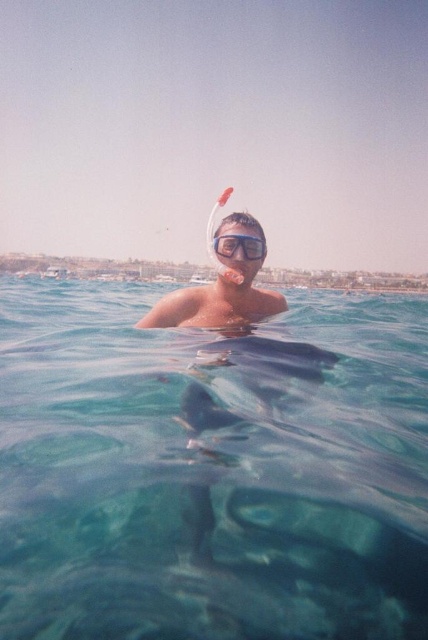
You are a lifeguard on duty and notice a swimmer in the water. You see the clear blue water at center and the matte plastic snorkel at upper center. Which object is closer to the right side of the image?

The clear blue water at center is to the right of the matte plastic snorkel at upper center, so the clear blue water at center is closer to the right side of the image.

You are a lifeguard observing the snorkeler in the scene. You need to check if the snorkel and goggles are positioned correctly for safe use. According to the image, is the matte plastic snorkel at upper center located to the left or right of the transparent plastic goggles at center?

The matte plastic snorkel at upper center is to the left of the transparent plastic goggles at center, which is the correct positioning for safe snorkeling as it allows the user to breathe comfortably without obstructing their vision.

You are a drone operator trying to capture the best aerial shot of the clear blue water at center. The drone has a camera with a 100mm lens that can focus on objects within a 0.5 meter radius. If the point at coordinates (211, 470) marks the exact center of the clear blue water at center, will the drone be able to focus on this area?

The point at coordinates (211, 470) marks the exact center of the clear blue water at center. Since the drone camera can focus on objects within a 0.5 meter radius, it should be able to focus on the clear blue water at center as long as the drone is positioned within that range.